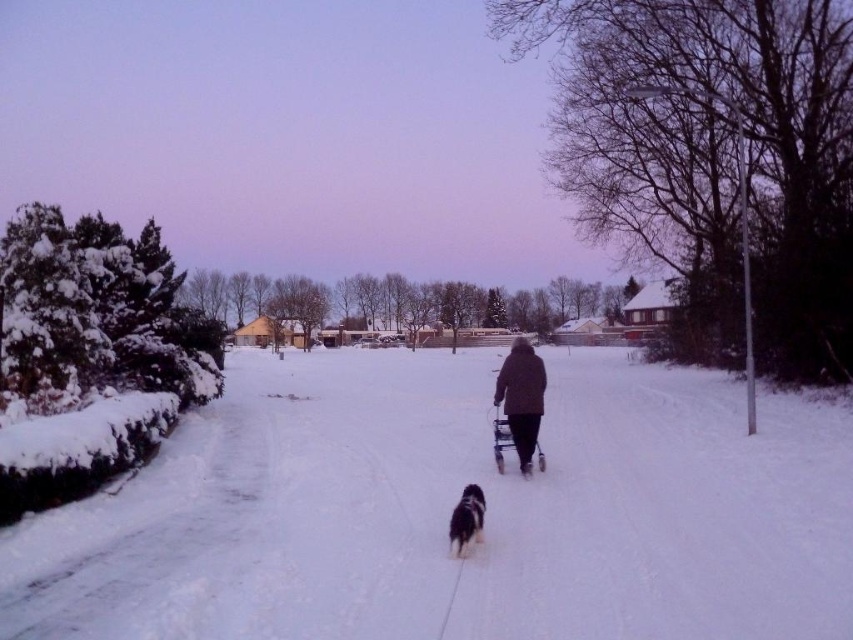
Question: Which point is closer to the camera taking this photo?

Choices:
 (A) (474, 493)
 (B) (497, 445)
 (C) (724, 416)

Answer: (A)

Question: Which of the following is the closest to the observer?

Choices:
 (A) (515, 362)
 (B) (372, 541)
 (C) (497, 422)
 (D) (450, 536)

Answer: (D)

Question: Does brown woolen coat at center have a greater width compared to fluffy black dog at center?

Choices:
 (A) no
 (B) yes

Answer: (B)

Question: Does white fluffy snow at center appear on the right side of brown woolen coat at center?

Choices:
 (A) yes
 (B) no

Answer: (B)

Question: Which is farther from the brown woolen coat at center?

Choices:
 (A) white fluffy snow at center
 (B) black plastic walker at center

Answer: (A)

Question: Does brown woolen coat at center appear on the left side of fluffy black dog at center?

Choices:
 (A) no
 (B) yes

Answer: (A)